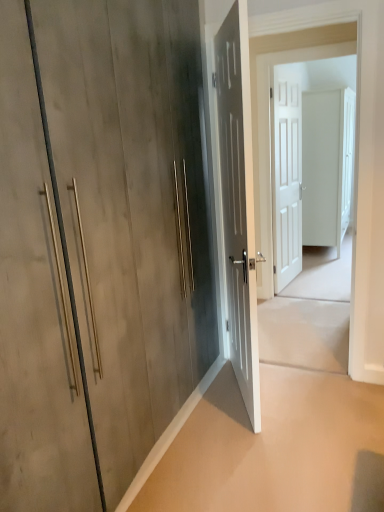
Image resolution: width=384 pixels, height=512 pixels. Find the location of `blank space to the left of matte gray door at center, positioned as the 3th door in back-to-front order`. blank space to the left of matte gray door at center, positioned as the 3th door in back-to-front order is located at coordinates tap(209, 400).